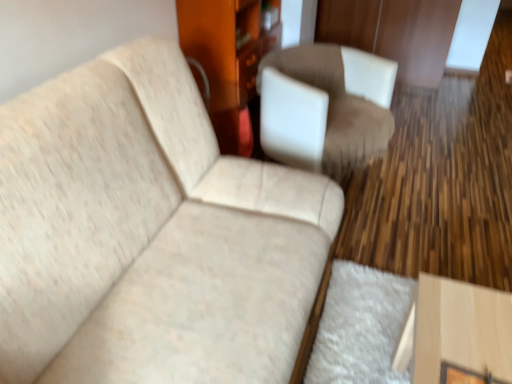
Question: In terms of height, does wooden dresser at center look taller or shorter compared to suede-like brown chair at center?

Choices:
 (A) tall
 (B) short

Answer: (A)

Question: From the image's perspective, is wooden dresser at center positioned above or below suede-like brown chair at center?

Choices:
 (A) above
 (B) below

Answer: (A)

Question: Which is nearer to the beige fabric couch at upper left?

Choices:
 (A) suede-like brown chair at center
 (B) wooden dresser at center

Answer: (A)

Question: Considering the real-world distances, which object is closest to the wooden dresser at center?

Choices:
 (A) beige fabric couch at upper left
 (B) suede-like brown chair at center

Answer: (B)